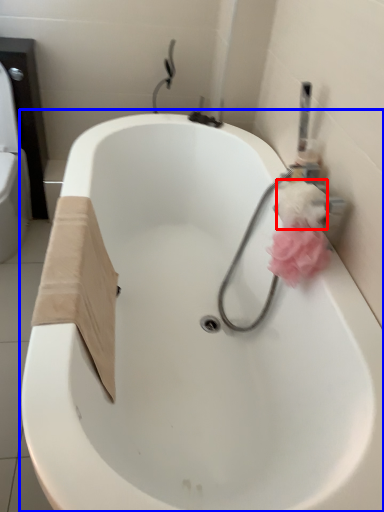
Question: Which object appears closest to the camera in this image, toilet paper (highlighted by a red box) or bathtub (highlighted by a blue box)?

Choices:
 (A) toilet paper
 (B) bathtub

Answer: (B)